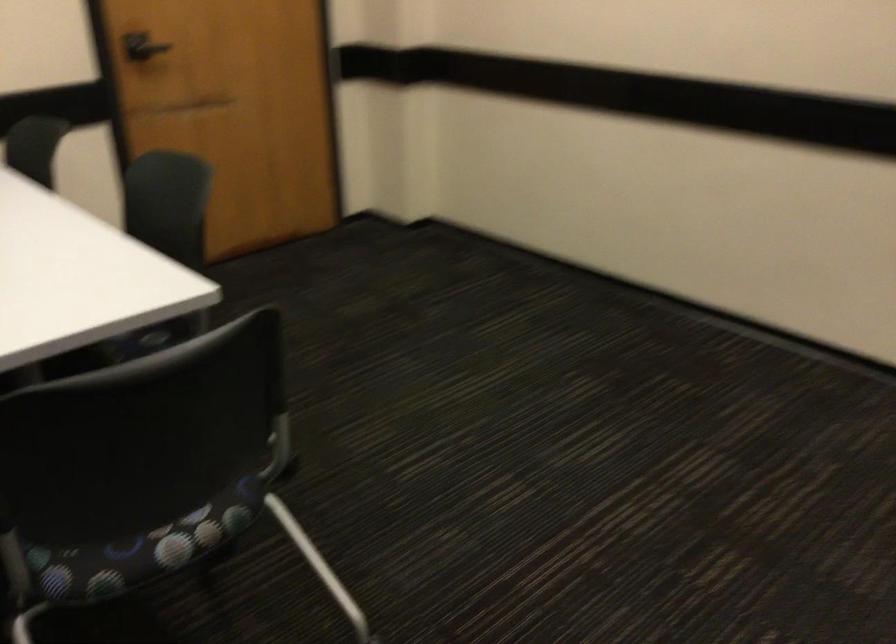
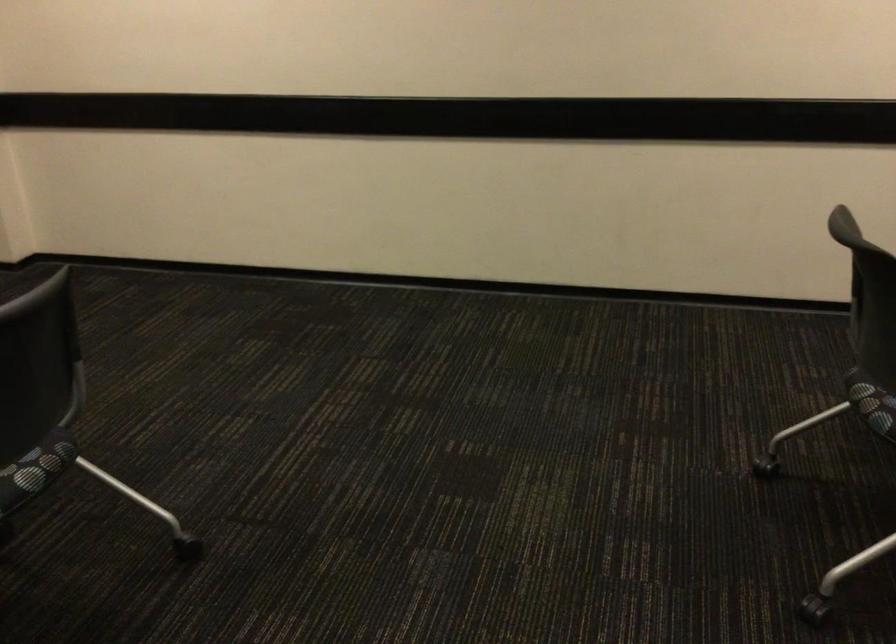
Question: The camera is either moving clockwise (left) or counter-clockwise (right) around the object. The first image is from the beginning of the video and the second image is from the end. Is the camera moving left or right when shooting the video?

Choices:
 (A) Left
 (B) Right

Answer: (A)